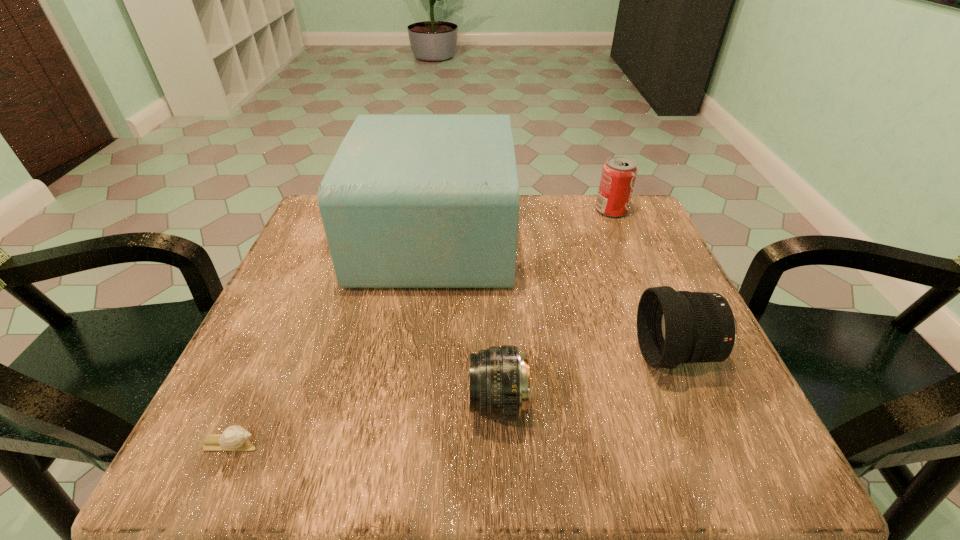
In the image, there is a desktop. Where is `vacant space at the right edge`? The height and width of the screenshot is (540, 960). vacant space at the right edge is located at coordinates (629, 341).

You are a GUI agent. You are given a task and a screenshot of the screen. Output one action in this format:
    pyautogui.click(x=<x>, y=<y>)
    Task: Click on the vacant space at the near left corner of the desktop
    
    Given the screenshot: What is the action you would take?
    click(x=278, y=465)

In the image, there is a desktop. What are the coordinates of `vacant space at the far right corner` in the screenshot? It's located at (642, 248).

In order to click on vacant space that's between the shortest object and the soda can in this screenshot , I will do `click(420, 327)`.

Find the location of `empty space between the soda can and the radio receiver`. empty space between the soda can and the radio receiver is located at coordinates (523, 224).

At what (x,y) coordinates should I click in order to perform the action: click on free space that is in between the right telephoto lens and the fourth tallest object. Please return your answer as a coordinate pair (x, y). Looking at the image, I should click on (588, 379).

The width and height of the screenshot is (960, 540). What are the coordinates of `vacant area that lies between the leftmost object and the left telephoto lens` in the screenshot? It's located at click(x=364, y=424).

Identify the location of empty space that is in between the tallest object and the soda can. Image resolution: width=960 pixels, height=540 pixels. (523, 224).

Where is `free space between the right telephoto lens and the leftmost object`? This screenshot has width=960, height=540. free space between the right telephoto lens and the leftmost object is located at coordinates (453, 399).

You are a GUI agent. You are given a task and a screenshot of the screen. Output one action in this format:
    pyautogui.click(x=<x>, y=<y>)
    Task: Click on the free space between the soda can and the left telephoto lens
    
    Given the screenshot: What is the action you would take?
    pyautogui.click(x=555, y=307)